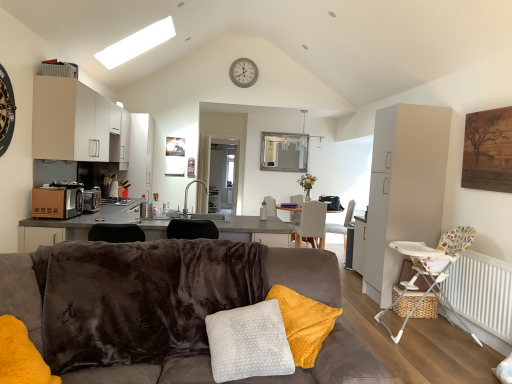
Question: From the image's perspective, is silver metallic faucet at center below white glossy armchair at center?

Choices:
 (A) no
 (B) yes

Answer: (A)

Question: Is silver metallic faucet at center closer to camera compared to white glossy armchair at center?

Choices:
 (A) no
 (B) yes

Answer: (B)

Question: Is silver metallic faucet at center at the right side of white glossy armchair at center?

Choices:
 (A) no
 (B) yes

Answer: (A)

Question: Can white glossy armchair at center be found inside silver metallic faucet at center?

Choices:
 (A) yes
 (B) no

Answer: (B)

Question: Is the surface of silver metallic faucet at center in direct contact with white glossy armchair at center?

Choices:
 (A) yes
 (B) no

Answer: (B)

Question: From the image's perspective, is silver metallic faucet at center on top of white glossy armchair at center?

Choices:
 (A) no
 (B) yes

Answer: (B)

Question: From the image's perspective, is white matte cabinet at upper left, marked as the 1th cabinetry in a left-to-right arrangement, on white plastic highchair at lower right, placed as the 1th chair when sorted from front to back?

Choices:
 (A) yes
 (B) no

Answer: (A)

Question: From a real-world perspective, is white matte cabinet at upper left, marked as the 1th cabinetry in a left-to-right arrangement, physically below white plastic highchair at lower right, placed as the 1th chair when sorted from front to back?

Choices:
 (A) yes
 (B) no

Answer: (B)

Question: Is white matte cabinet at upper left, arranged as the second cabinetry when viewed from the right, facing away from white plastic highchair at lower right, which is counted as the third chair, starting from the back?

Choices:
 (A) yes
 (B) no

Answer: (B)

Question: From the image's perspective, does white matte cabinet at upper left, arranged as the second cabinetry when viewed from the right, appear lower than white plastic highchair at lower right, which is counted as the third chair, starting from the back?

Choices:
 (A) no
 (B) yes

Answer: (A)

Question: Considering the relative sizes of white matte cabinet at upper left, marked as the 1th cabinetry in a left-to-right arrangement, and white plastic highchair at lower right, which is counted as the third chair, starting from the back, in the image provided, is white matte cabinet at upper left, marked as the 1th cabinetry in a left-to-right arrangement, taller than white plastic highchair at lower right, which is counted as the third chair, starting from the back,?

Choices:
 (A) no
 (B) yes

Answer: (A)

Question: Is white matte cabinet at upper left, marked as the 1th cabinetry in a left-to-right arrangement, bigger than white plastic highchair at lower right, placed as the 1th chair when sorted from front to back?

Choices:
 (A) no
 (B) yes

Answer: (B)

Question: Is the depth of light gray fabric chair at center, the third chair from the front, less than that of white fabric chair at center, which appears as the second chair when viewed from the back?

Choices:
 (A) no
 (B) yes

Answer: (A)